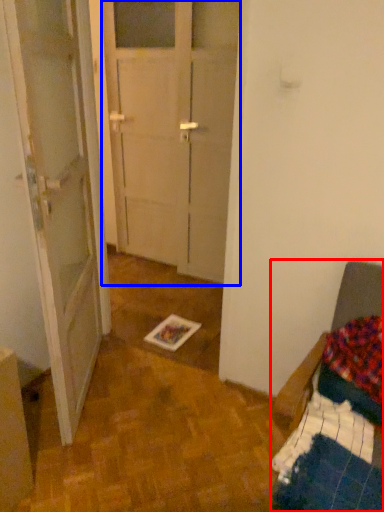
Question: Which point is closer to the camera, furniture (highlighted by a red box) or glass door (highlighted by a blue box)?

Choices:
 (A) furniture
 (B) glass door

Answer: (A)